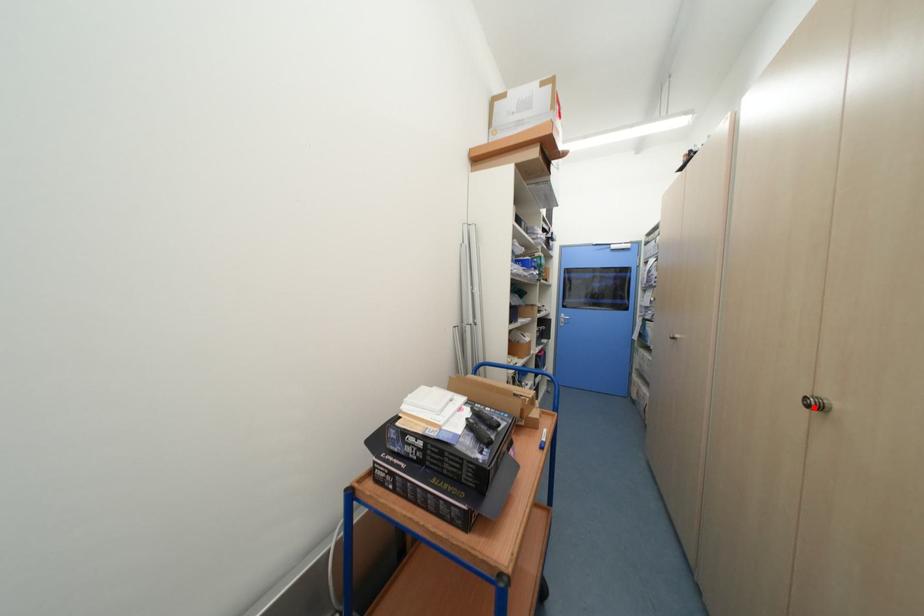
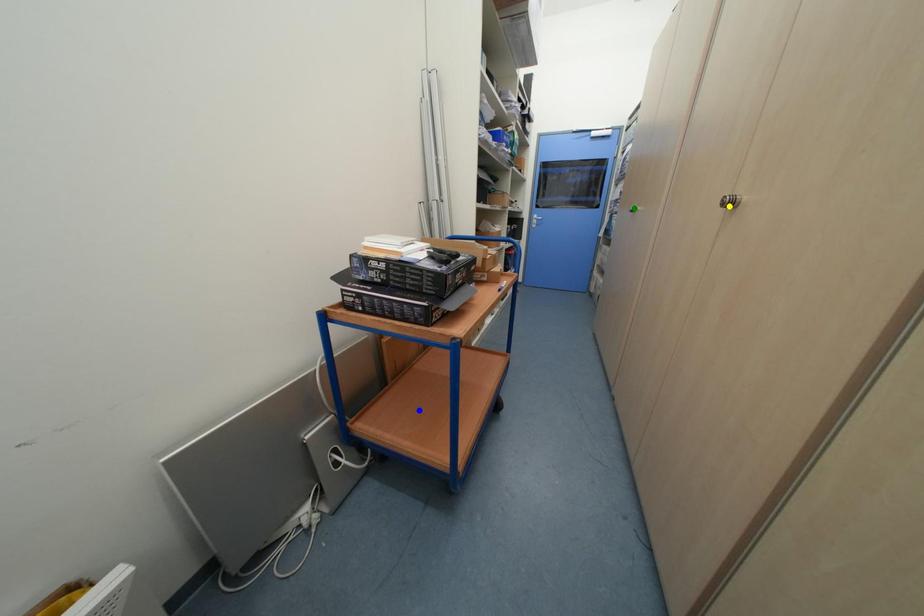
Question: I am providing you with two images of the same scene from different viewpoints. A red point is marked on the first image. You are given multiple points on the second image. Which mark in image 2 goes with the point in image 1?

Choices:
 (A) green point
 (B) yellow point
 (C) blue point

Answer: (B)